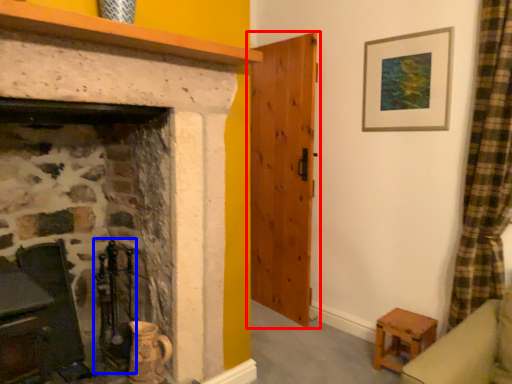
Question: Which object is further to the camera taking this photo, door (highlighted by a red box) or chair (highlighted by a blue box)?

Choices:
 (A) door
 (B) chair

Answer: (A)